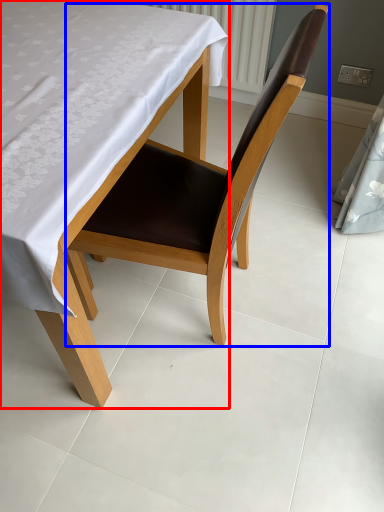
Question: Which of the following is the farthest to the observer, table (highlighted by a red box) or chair (highlighted by a blue box)?

Choices:
 (A) table
 (B) chair

Answer: (B)